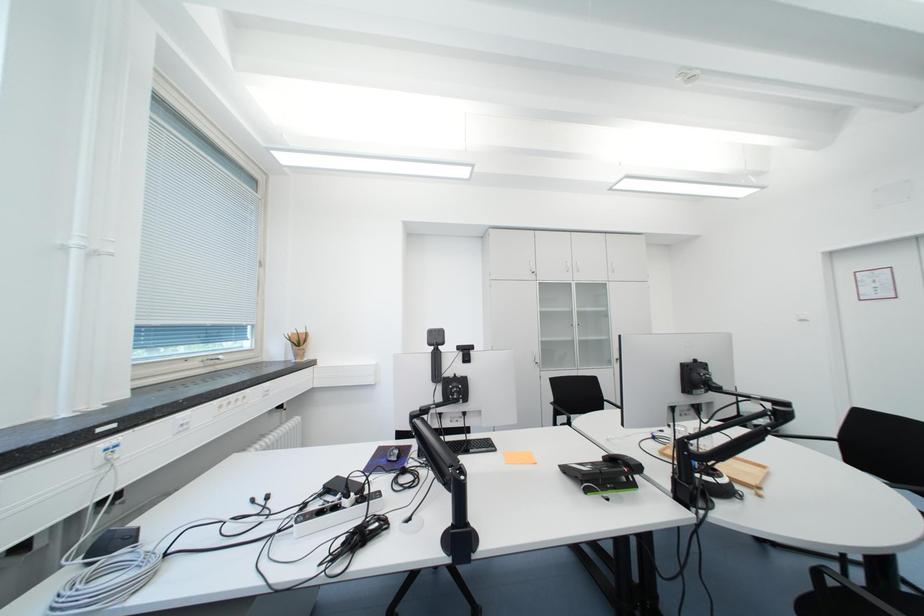
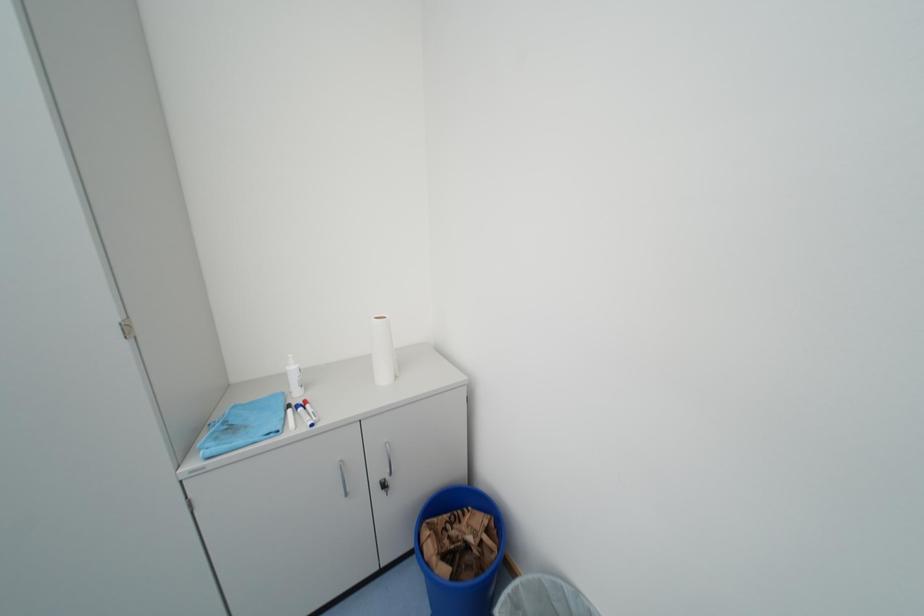
Which direction would the cameraman need to move to produce the second image?

The cameraman moved toward right, forward.